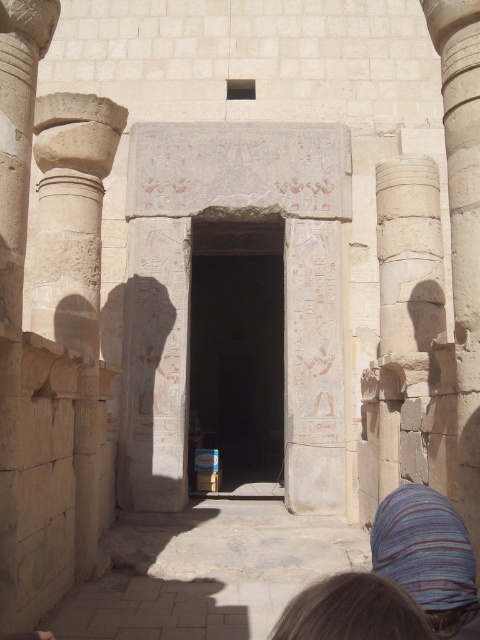
Question: Is dark stone doorway at center to the right of brown hair at lower center from the viewer's perspective?

Choices:
 (A) yes
 (B) no

Answer: (B)

Question: Among these points, which one is farthest from the camera?

Choices:
 (A) (397, 195)
 (B) (446, 531)

Answer: (A)

Question: Which object is positioned closest to the brown hair at lower center?

Choices:
 (A) dark stone doorway at center
 (B) striped fabric at lower right

Answer: (B)

Question: Can you confirm if smooth stone column at right is positioned above brown hair at lower center?

Choices:
 (A) yes
 (B) no

Answer: (A)

Question: Which of the following is the farthest from the observer?

Choices:
 (A) click(x=393, y=490)
 (B) click(x=418, y=353)
 (C) click(x=286, y=634)

Answer: (A)

Question: Observing the image, what is the correct spatial positioning of striped fabric at lower right in reference to brown hair at lower center?

Choices:
 (A) below
 (B) above

Answer: (B)